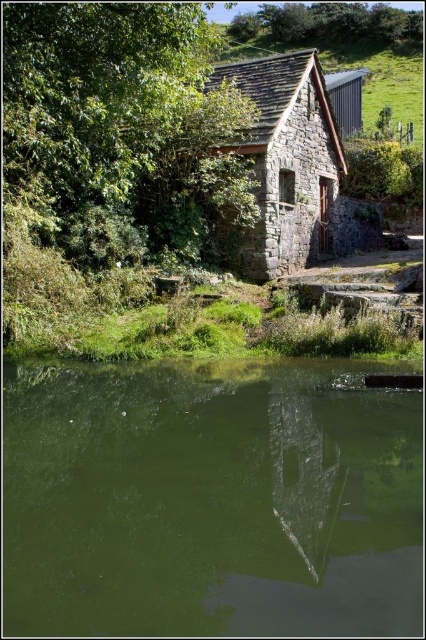
You are standing at the point labeled as point (210, 500) in the image. What do you see directly in front of you?

You see green reflective water at center directly in front of you at point (210, 500).

You are standing in a rural area and see the green reflective water at center and the green leafy tree at upper left. Which object takes up more space in the image?

The green leafy tree at upper left takes up more space in the image since the green reflective water at center has a smaller size compared to it.

You are an architect designing a new garden layout around the rustic stone cottage at center. You want to plant a new tree that matches the existing green leafy tree at upper left. Based on the scene, what size should the new tree be relative to the cottage?

The green leafy tree at upper left has a smaller size compared to rustic stone cottage at center, so the new tree should be planted to have a smaller size relative to the cottage to match the existing tree.